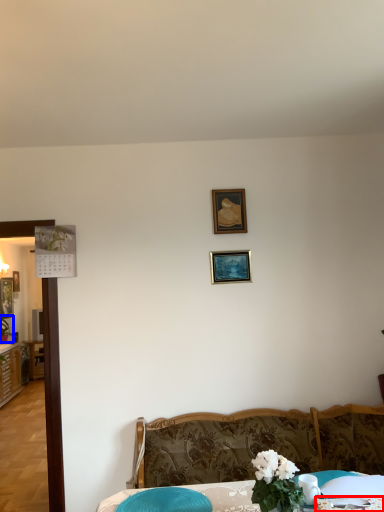
Question: Which object appears farthest to the camera in this image, tablecloth (highlighted by a red box) or plant (highlighted by a blue box)?

Choices:
 (A) tablecloth
 (B) plant

Answer: (B)